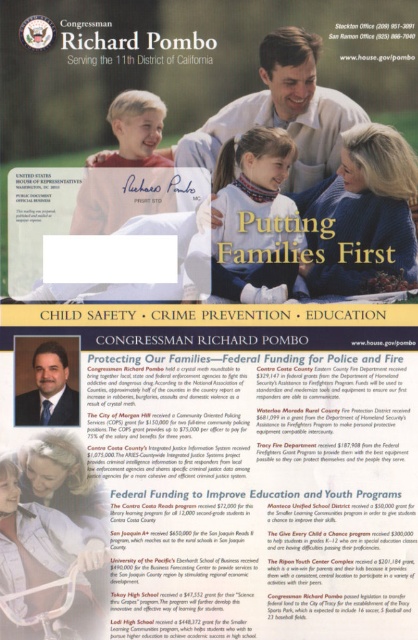
Between point (277, 193) and point (30, 413), which one is positioned behind?

Positioned behind is point (277, 193).

Between light blue fabric at center and blue suit at center, which one is positioned higher?

Positioned higher is light blue fabric at center.

Does point (224, 161) come farther from viewer compared to point (33, 362)?

No, (224, 161) is closer to viewer.

At what (x,y) coordinates should I click in order to perform the action: click on light blue fabric at center. Please return your answer as a coordinate pair (x, y). This screenshot has height=640, width=418. Looking at the image, I should click on (254, 218).